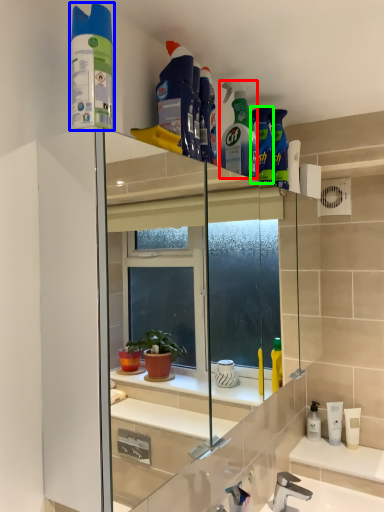
Question: Which object is positioned closest to cleaning product (highlighted by a red box)? Select from cleaning product (highlighted by a blue box) and cleaning product (highlighted by a green box).

Choices:
 (A) cleaning product
 (B) cleaning product

Answer: (B)